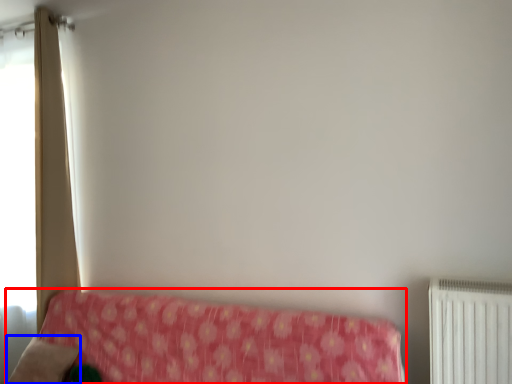
Question: Which point is further to the camera, furniture (highlighted by a red box) or pillow (highlighted by a blue box)?

Choices:
 (A) furniture
 (B) pillow

Answer: (B)